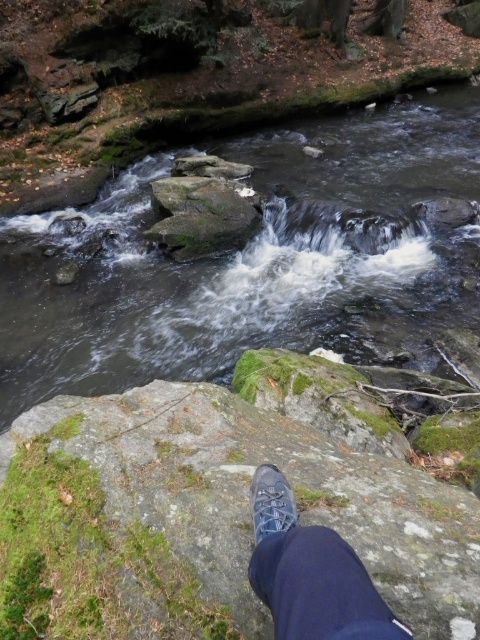
Locate an element on the screen. smooth gray rock at center is located at coordinates (251, 259).

Is the position of smooth gray rock at center less distant than that of blue suede shoe at lower center?

No, it is not.

Who is more distant from viewer, (x=420, y=170) or (x=272, y=496)?

Point (x=420, y=170)

Identify the location of smooth gray rock at center. The width and height of the screenshot is (480, 640). (251, 259).

Does point (387, 620) lie behind point (256, 518)?

No, it is in front of (256, 518).

Does dark blue fabric shoe at lower center have a smaller size compared to blue suede shoe at lower center?

Actually, dark blue fabric shoe at lower center might be larger than blue suede shoe at lower center.

Does point (346, 557) come in front of point (264, 509)?

Yes.

Where is `dark blue fabric shoe at lower center`? dark blue fabric shoe at lower center is located at coordinates (311, 572).

Is smooth gray rock at center behind dark blue fabric shoe at lower center?

Yes.

Between point (32, 397) and point (287, 538), which one is positioned behind?

The point (32, 397) is behind.

Where is `smooth gray rock at center`? Image resolution: width=480 pixels, height=640 pixels. smooth gray rock at center is located at coordinates (251, 259).